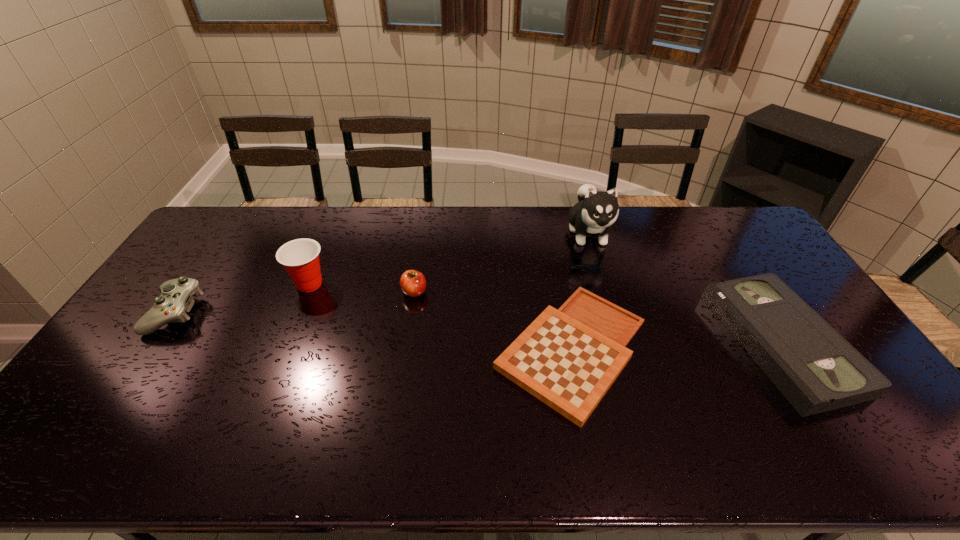
Identify the location of puppy. (596, 211).

What are the coordinates of `the farthest object` in the screenshot? It's located at (596, 211).

Image resolution: width=960 pixels, height=540 pixels. I want to click on the fifth object from right to left, so click(300, 257).

The height and width of the screenshot is (540, 960). I want to click on the second tallest object, so tap(300, 257).

What are the coordinates of `control` in the screenshot? It's located at (176, 299).

Identify the location of apple. The width and height of the screenshot is (960, 540). (413, 283).

Locate an element on the screen. the fifth tallest object is located at coordinates (812, 365).

At what (x,y) coordinates should I click in order to perform the action: click on the rightmost object. Please return your answer as a coordinate pair (x, y). Image resolution: width=960 pixels, height=540 pixels. Looking at the image, I should click on (812, 365).

Locate an element on the screen. The height and width of the screenshot is (540, 960). the shortest object is located at coordinates (568, 358).

Find the location of `blank space located at the face of the farthest object`. blank space located at the face of the farthest object is located at coordinates (607, 296).